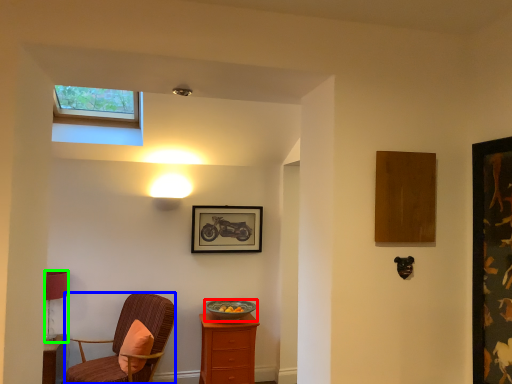
Question: Which is nearer to the bowl (highlighted by a red box)? chair (highlighted by a blue box) or lamp (highlighted by a green box).

Choices:
 (A) chair
 (B) lamp

Answer: (A)